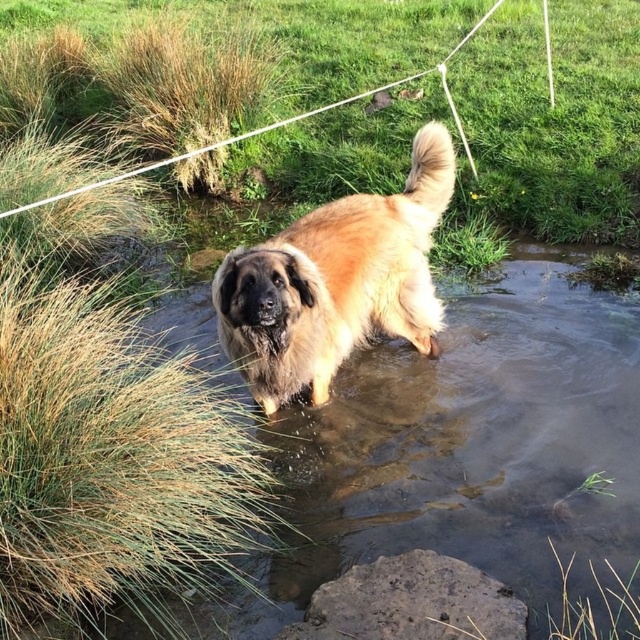
Who is positioned more to the right, green grass at upper center or fuzzy brown dog at center?

From the viewer's perspective, green grass at upper center appears more on the right side.

Where is `green grass at upper center`? The width and height of the screenshot is (640, 640). green grass at upper center is located at coordinates (554, 120).